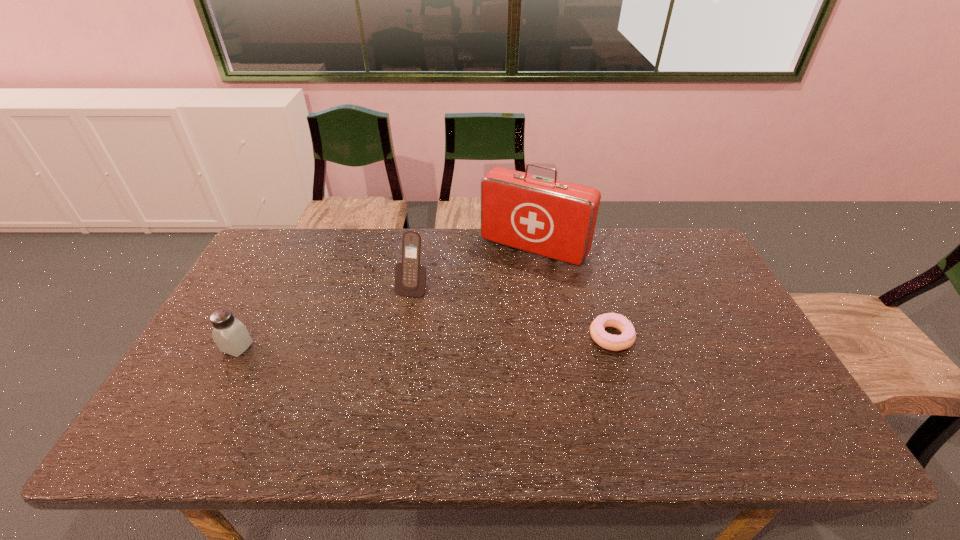
Image resolution: width=960 pixels, height=540 pixels. In order to click on the second shortest object in this screenshot , I will do `click(231, 336)`.

Locate an element on the screen. The height and width of the screenshot is (540, 960). the leftmost object is located at coordinates (x=231, y=336).

Locate an element on the screen. This screenshot has height=540, width=960. doughnut is located at coordinates (607, 341).

Identify the location of cellular telephone. (410, 277).

At what (x,y) coordinates should I click in order to perform the action: click on the second farthest object. Please return your answer as a coordinate pair (x, y). Image resolution: width=960 pixels, height=540 pixels. Looking at the image, I should click on (410, 277).

You are a GUI agent. You are given a task and a screenshot of the screen. Output one action in this format:
    pyautogui.click(x=<x>, y=<y>)
    Task: Click on the first-aid kit
    The width and height of the screenshot is (960, 540).
    Given the screenshot: What is the action you would take?
    pyautogui.click(x=556, y=219)

You are a GUI agent. You are given a task and a screenshot of the screen. Output one action in this format:
    pyautogui.click(x=<x>, y=<y>)
    Task: Click on the tallest object
    The width and height of the screenshot is (960, 540).
    Given the screenshot: What is the action you would take?
    pyautogui.click(x=556, y=219)

Locate an element on the screen. vacant area situated on the right of the third tallest object is located at coordinates (338, 347).

I want to click on vacant space located on the back of the doughnut, so click(585, 246).

Identify the location of vacant space situated on the front-facing side of the third object from right to left. The image size is (960, 540). (378, 368).